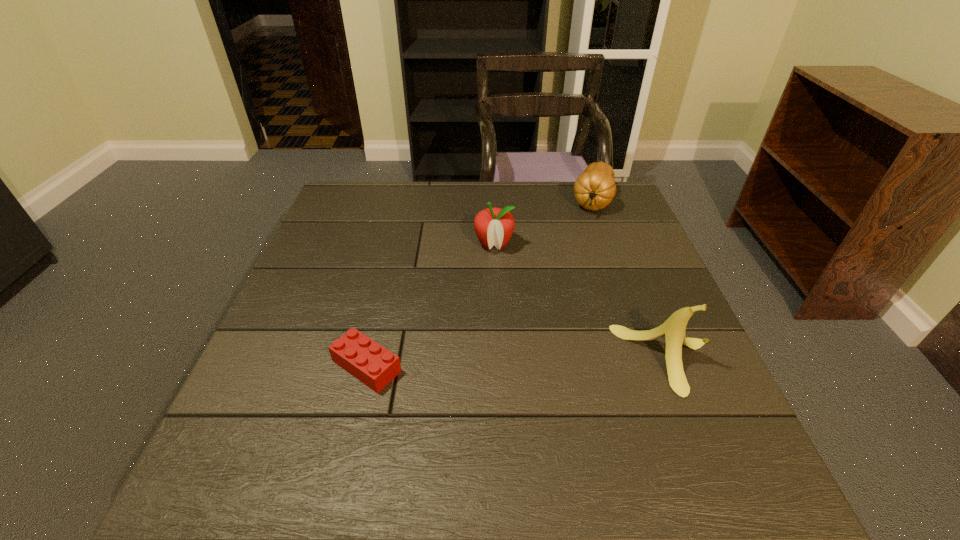
Identify the location of vacant area at the near edge. (408, 421).

Identify the location of vacant space at the left edge of the desktop. The width and height of the screenshot is (960, 540). (252, 397).

In the image, there is a desktop. Where is `blank space at the right edge`? This screenshot has width=960, height=540. blank space at the right edge is located at coordinates (659, 389).

This screenshot has height=540, width=960. I want to click on free spot at the near right corner of the desktop, so click(x=655, y=424).

Locate an element on the screen. The width and height of the screenshot is (960, 540). free point between the shortest object and the gourd is located at coordinates (480, 284).

What are the coordinates of `vacant area that lies between the Lego and the farthest object` in the screenshot? It's located at (480, 284).

Locate an element on the screen. blank region between the tallest object and the gourd is located at coordinates (630, 280).

Where is `free space between the gourd and the Lego`? free space between the gourd and the Lego is located at coordinates (480, 284).

Identify the location of unoccupied area between the tallest object and the third nearest object. point(581,302).

Where is `vacant region between the Lego and the farthest object`? This screenshot has height=540, width=960. vacant region between the Lego and the farthest object is located at coordinates (480, 284).